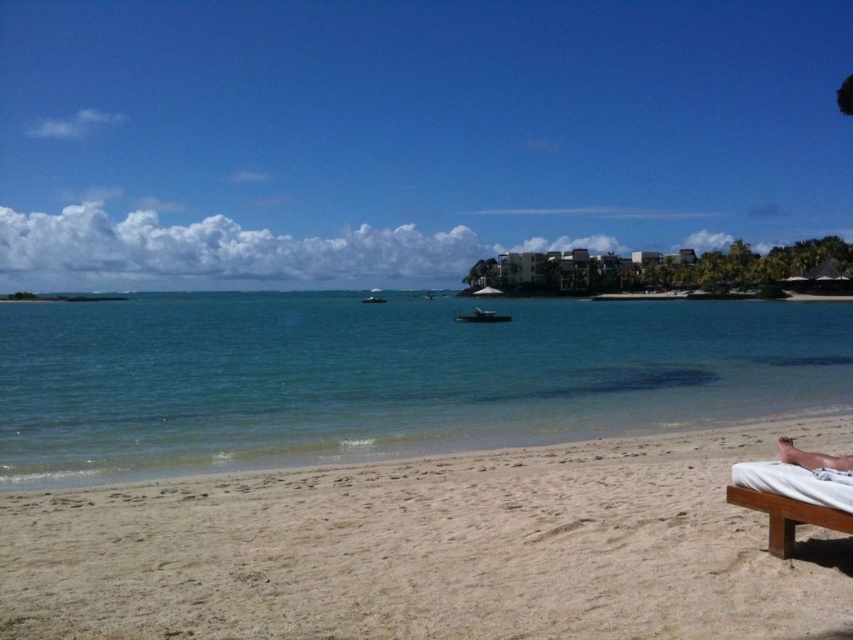
Looking at this image, you are planning to set up a small umbrella next to the white fabric beach chair at lower right. Since you want the umbrella to be as close as possible to the clear blue water at center without blocking the view of the water from the chair, where should you place it?

The clear blue water at center is bigger than the white fabric beach chair at lower right, so you should place the umbrella between the white fabric beach chair at lower right and the edge of the clear blue water at center, ensuring it doesn not obstruct the view of the larger water area.

You are standing on the beach and want to take a photo of the clear blue water at center and the tan skin person at lower right. Which object should you place on the left side of your photo frame?

You should place the clear blue water at center on the left side of your photo frame because it is already positioned to the left of the tan skin person at lower right.

You are standing on the beach and want to place a 2.5 meter long boat exactly at the point marked as point (534,532). Can you safely anchor the boat at that point without it extending beyond the visible beach area?

The point (534,532) is 7.38 meters from the viewer. Since the boat is 2.5 meters long, anchoring it there would require ensuring it doesn